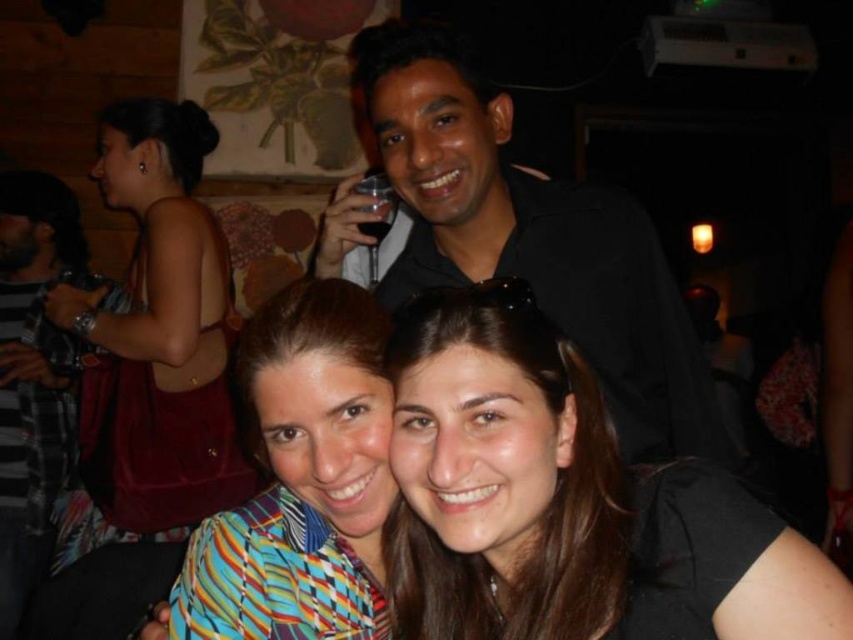
Question: Which object appears closest to the camera in this image?

Choices:
 (A) striped fabric shirt at center
 (B) brushed metal shirt at upper center
 (C) black matte shirt at upper center
 (D) transparent plastic wine glass at upper center

Answer: (A)

Question: Is the position of black matte hair at center less distant than that of black matte shirt at upper center?

Choices:
 (A) yes
 (B) no

Answer: (A)

Question: Among these points, which one is farthest from the camera?

Choices:
 (A) (459, 317)
 (B) (7, 417)

Answer: (B)

Question: Can you confirm if black matte shirt at upper center is positioned to the left of transparent plastic wine glass at upper center?

Choices:
 (A) yes
 (B) no

Answer: (B)

Question: Is multicolored striped shirt at left further to camera compared to transparent plastic wine glass at upper center?

Choices:
 (A) no
 (B) yes

Answer: (B)

Question: Which point is farther from the camera taking this photo?

Choices:
 (A) (316, 428)
 (B) (381, 198)
 (C) (68, 376)
 (D) (630, 620)

Answer: (C)